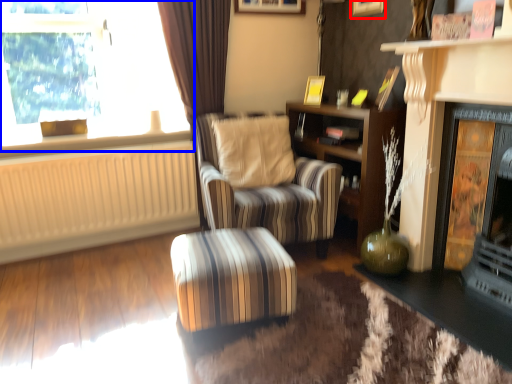
Question: Which point is further to the camera, picture frame (highlighted by a red box) or window (highlighted by a blue box)?

Choices:
 (A) picture frame
 (B) window

Answer: (A)